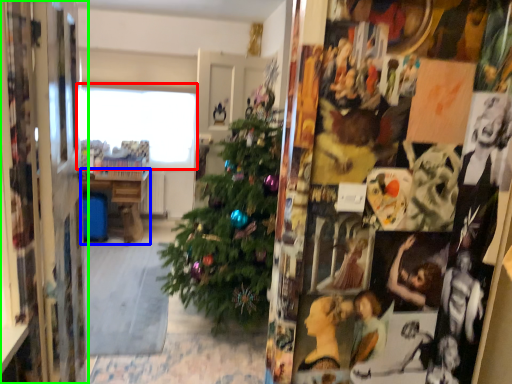
Question: Which is nearer to the window (highlighted by a red box)? table (highlighted by a blue box) or collage (highlighted by a green box).

Choices:
 (A) table
 (B) collage

Answer: (A)